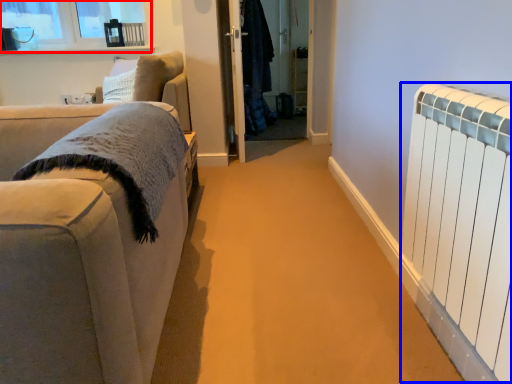
Question: Which object is closer to the camera taking this photo, window (highlighted by a red box) or radiator (highlighted by a blue box)?

Choices:
 (A) window
 (B) radiator

Answer: (B)